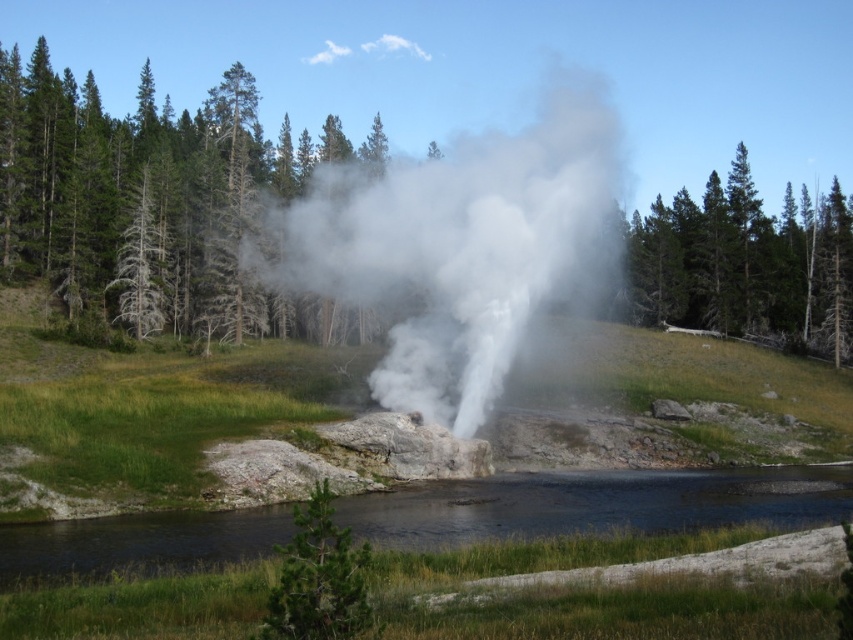
Measure the distance from green coniferous tree at upper right to green matte tree at lower center.

green coniferous tree at upper right and green matte tree at lower center are 89.44 meters apart from each other.

Which is below, green coniferous tree at upper right or green matte tree at lower center?

Positioned lower is green matte tree at lower center.

What do you see at coordinates (746, 264) in the screenshot?
I see `green coniferous tree at upper right` at bounding box center [746, 264].

The image size is (853, 640). I want to click on green coniferous tree at upper right, so click(x=746, y=264).

Who is shorter, green textured tree at center or clear water at center?

With less height is clear water at center.

Is green textured tree at center smaller than clear water at center?

Actually, green textured tree at center might be larger than clear water at center.

Who is more distant from viewer, (32, 246) or (149, 561)?

Positioned behind is point (32, 246).

Find the location of `green textured tree at center`. green textured tree at center is located at coordinates (160, 205).

Is point (445, 202) farther from camera compared to point (822, 294)?

No, it is not.

Who is more forward, (430,280) or (846,275)?

Point (430,280) is in front.

This screenshot has height=640, width=853. Identify the location of white vapor steam at center. (466, 244).